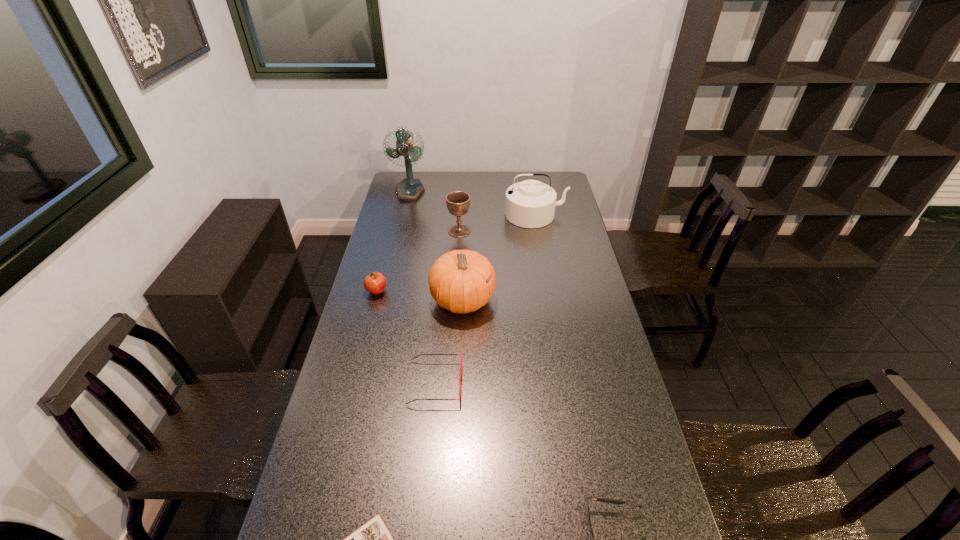
Locate an element on the screen. Image resolution: width=960 pixels, height=540 pixels. vacant space located 0.120m on the spout of the kettle is located at coordinates (540, 245).

The width and height of the screenshot is (960, 540). I want to click on free point located on the left of the fourth tallest object, so click(396, 231).

Locate an element on the screen. This screenshot has height=540, width=960. free space located on the back of the fourth shortest object is located at coordinates (388, 250).

Identify the location of free location located on the front-facing side of the sixth farthest object. (579, 383).

Where is `object located in the far edge section of the desktop`? The image size is (960, 540). object located in the far edge section of the desktop is located at coordinates (409, 189).

At what (x,y) coordinates should I click in order to perform the action: click on fan that is at the left edge. Please return your answer as a coordinate pair (x, y). Looking at the image, I should click on (409, 189).

Identify the location of apple that is at the left edge. This screenshot has width=960, height=540. (375, 283).

The height and width of the screenshot is (540, 960). Identify the location of object positioned at the right edge. (529, 204).

Locate an element on the screen. This screenshot has height=540, width=960. object at the far left corner is located at coordinates (409, 189).

In the image, there is a desktop. Where is `vacant space at the far edge`? The width and height of the screenshot is (960, 540). vacant space at the far edge is located at coordinates (487, 189).